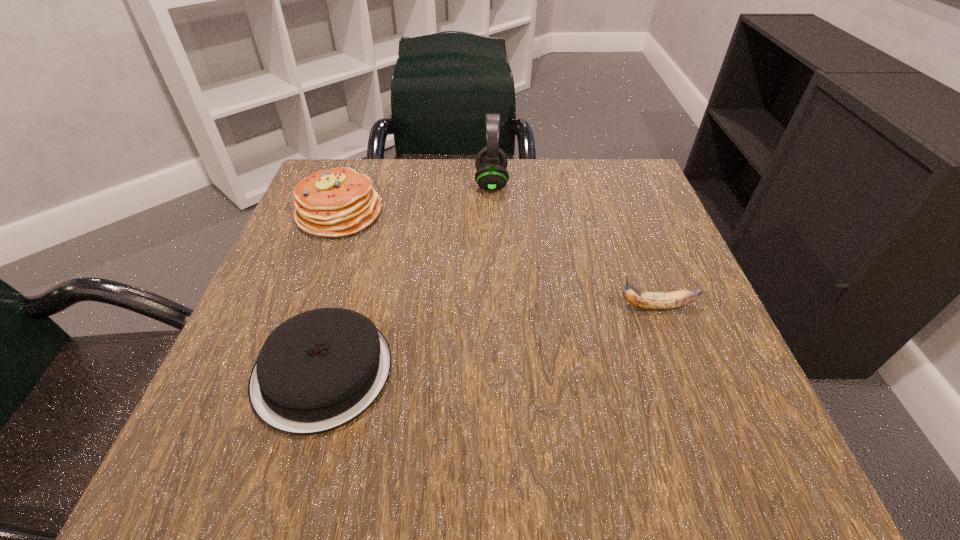
The width and height of the screenshot is (960, 540). Find the location of `free point between the headset and the nearer pancake`. free point between the headset and the nearer pancake is located at coordinates (407, 278).

Find the location of a particular element. This screenshot has width=960, height=540. vacant point located between the shorter pancake and the headset is located at coordinates (407, 278).

Identify the location of unoccupied area between the taller pancake and the nearest object. (331, 292).

What are the coordinates of `free spot between the shorter pancake and the banana` in the screenshot? It's located at (490, 339).

Identify the location of free space between the farther pancake and the shorter pancake. The height and width of the screenshot is (540, 960). (331, 292).

The height and width of the screenshot is (540, 960). Identify the location of free spot between the third farthest object and the shorter pancake. (490, 339).

The image size is (960, 540). I want to click on vacant point located between the banana and the farther pancake, so click(497, 260).

Find the location of `vacant space that is in between the farther pancake and the shorter pancake`. vacant space that is in between the farther pancake and the shorter pancake is located at coordinates (331, 292).

Image resolution: width=960 pixels, height=540 pixels. What are the coordinates of `the closest object to the headset` in the screenshot? It's located at (338, 202).

This screenshot has height=540, width=960. What are the coordinates of `object that is the second closest to the nearer pancake` in the screenshot? It's located at (491, 162).